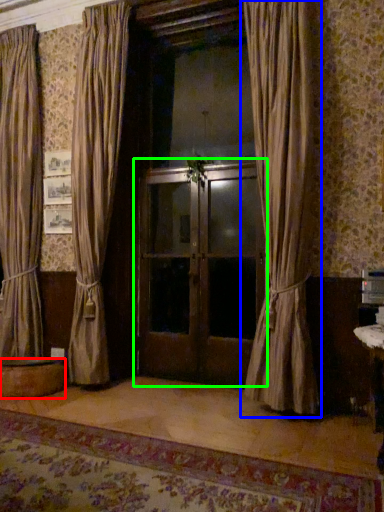
Question: Which is nearer to the round table (highlighted by a red box)? curtain (highlighted by a blue box) or door (highlighted by a green box).

Choices:
 (A) curtain
 (B) door

Answer: (B)